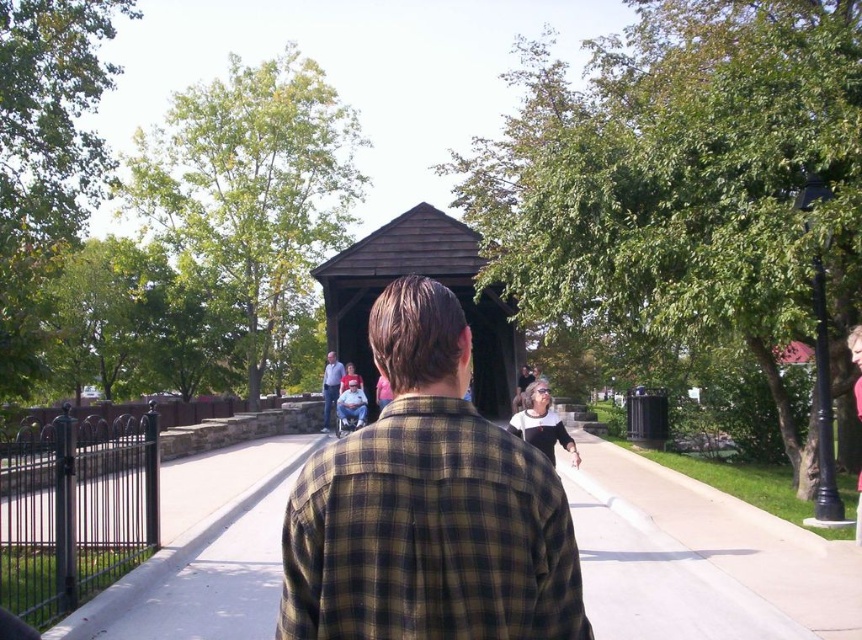
Consider the image. Is plaid shirt at center to the left of light blue shirt at center from the viewer's perspective?

No, plaid shirt at center is not to the left of light blue shirt at center.

Is plaid shirt at center positioned at the back of light blue shirt at center?

No.

The height and width of the screenshot is (640, 862). What do you see at coordinates (428, 506) in the screenshot?
I see `plaid shirt at center` at bounding box center [428, 506].

In order to click on plaid shirt at center in this screenshot , I will do `click(428, 506)`.

Which of these two, plaid shirt at center or brown wooden gazebo at center, stands shorter?

plaid shirt at center

The height and width of the screenshot is (640, 862). What do you see at coordinates (428, 506) in the screenshot?
I see `plaid shirt at center` at bounding box center [428, 506].

In order to click on plaid shirt at center in this screenshot , I will do `click(428, 506)`.

Does brown wooden gazebo at center lie in front of light blue shirt at center?

That is True.

Between brown wooden gazebo at center and light blue shirt at center, which one appears on the left side from the viewer's perspective?

light blue shirt at center is more to the left.

Is point (467, 234) farther from viewer compared to point (328, 368)?

That is True.

In order to click on brown wooden gazebo at center in this screenshot , I will do `click(431, 276)`.